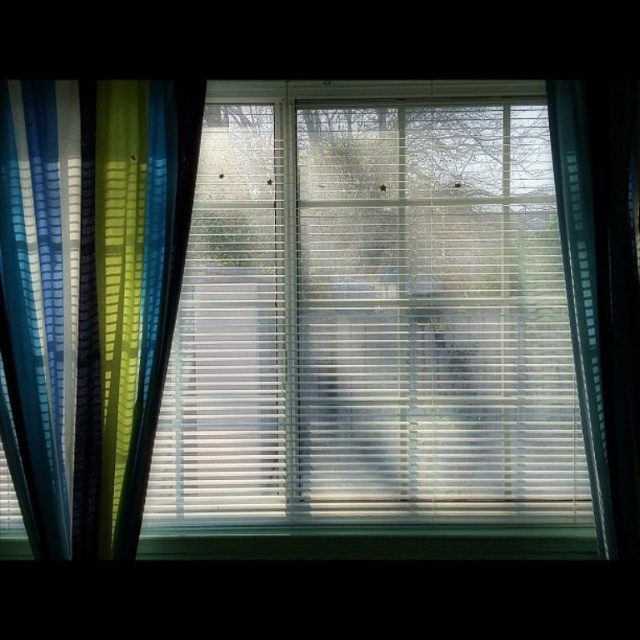
Does translucent plastic blinds at center appear on the right side of blue striped curtain at left?

Yes, translucent plastic blinds at center is to the right of blue striped curtain at left.

Who is more forward, (465,305) or (42,433)?

Point (42,433) is more forward.

Is point (468, 381) behind point (156, 246)?

Yes, it is.

This screenshot has width=640, height=640. I want to click on translucent plastic blinds at center, so click(x=371, y=320).